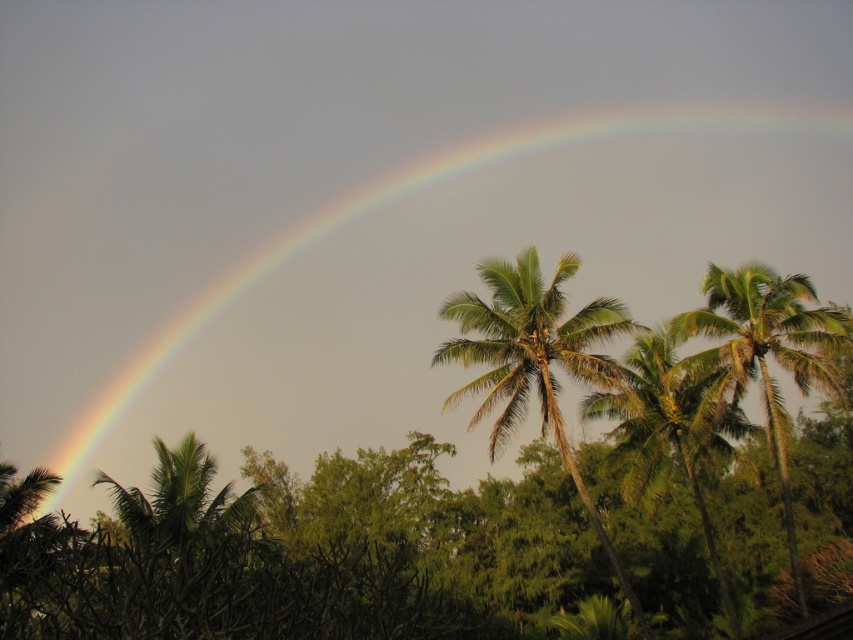
Based on the scene described, which object occupies a greater portion of the visual space between the rainbow at upper left and the green leafy palm at upper right?

The rainbow at upper left occupies a greater portion of the visual space compared to the green leafy palm at upper right due to its larger size.

You are standing in a tropical garden and want to place a small statue between the two points, point (387, 282) and point (622, 440). Which point should the statue be closer to if you want it to be more visible from where you are standing?

The statue should be placed closer to point (387, 282) because it is closer to the viewer than point (622, 440), making it more visible from your current position.